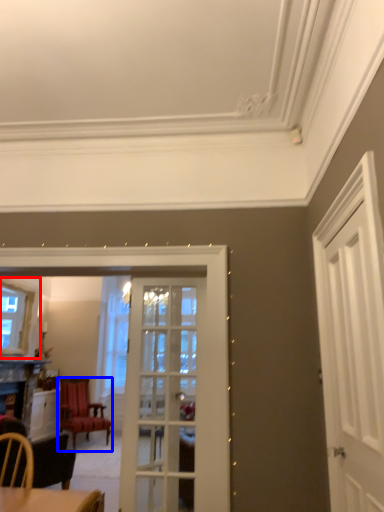
Question: Which object is further to the camera taking this photo, window (highlighted by a red box) or chair (highlighted by a blue box)?

Choices:
 (A) window
 (B) chair

Answer: (B)